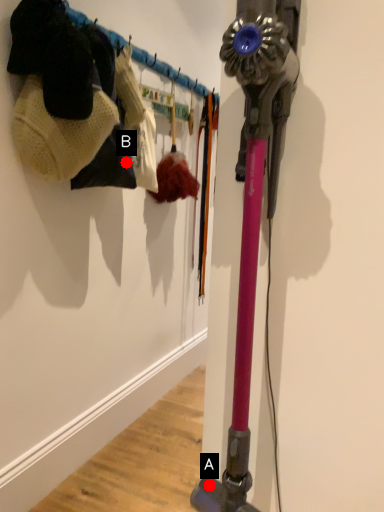
Question: Two points are circled on the image, labeled by A and B beside each circle. Among these points, which one is farthest from the camera?

Choices:
 (A) A is further
 (B) B is further

Answer: (B)